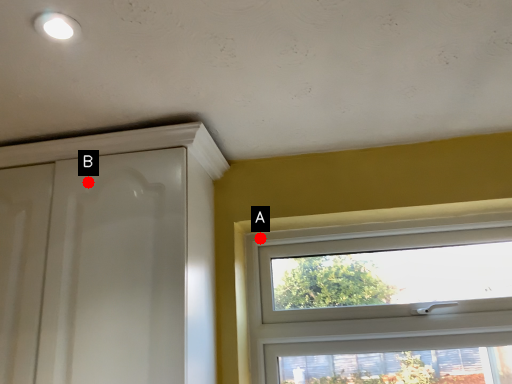
Question: Two points are circled on the image, labeled by A and B beside each circle. Among these points, which one is farthest from the camera?

Choices:
 (A) A is further
 (B) B is further

Answer: (A)